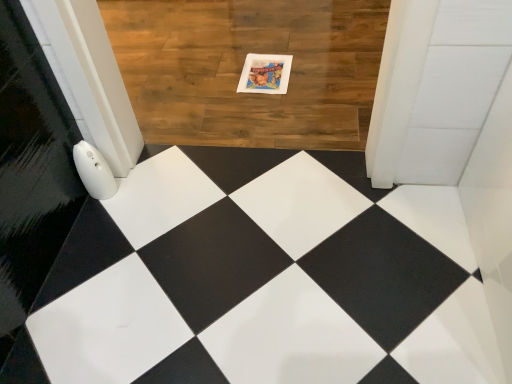
Find the location of a particular element. This screenshot has width=512, height=384. spots to the right of matte paper postcard at center is located at coordinates (316, 69).